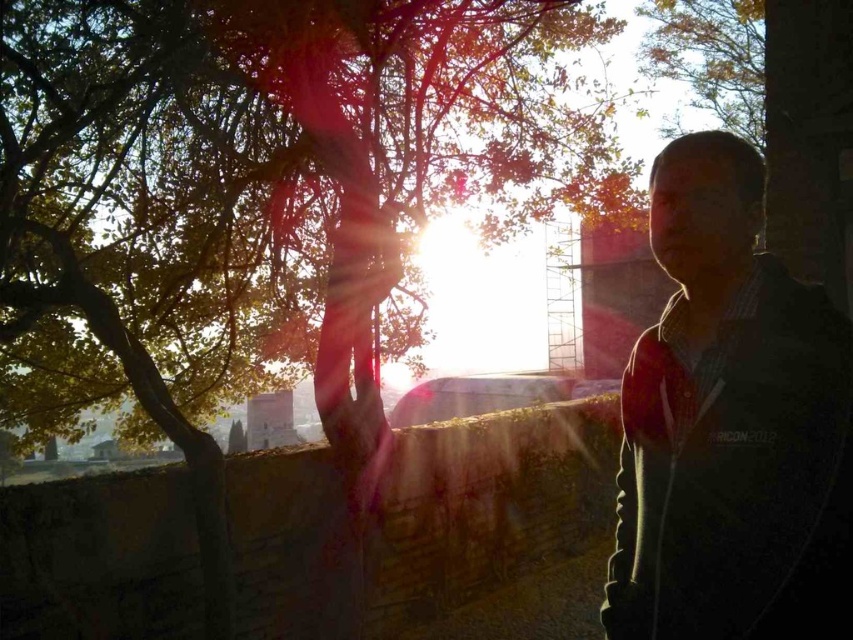
Can you confirm if dark green textured jacket at right is positioned to the left of yellow-green leaves at upper center?

Indeed, dark green textured jacket at right is positioned on the left side of yellow-green leaves at upper center.

Where is `dark green textured jacket at right`? dark green textured jacket at right is located at coordinates (730, 426).

Find the location of a particular element. The width and height of the screenshot is (853, 640). dark green textured jacket at right is located at coordinates (730, 426).